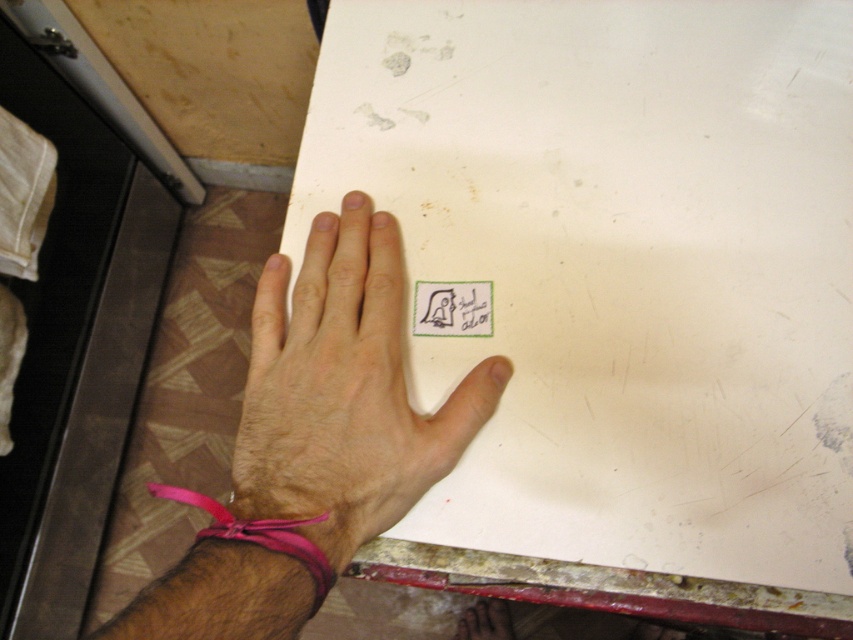
Question: Which of the following is the farthest from the observer?

Choices:
 (A) (236, 433)
 (B) (508, 625)

Answer: (B)

Question: Is green fabric sticker at center smaller than pink fabric wristband at lower center?

Choices:
 (A) no
 (B) yes

Answer: (B)

Question: Among these points, which one is farthest from the camera?

Choices:
 (A) (494, 605)
 (B) (372, 449)

Answer: (A)

Question: Where is white matte paper at center located in relation to hair-covered skin at center in the image?

Choices:
 (A) below
 (B) above

Answer: (B)

Question: Does white matte paper at center have a lesser width compared to green fabric sticker at center?

Choices:
 (A) yes
 (B) no

Answer: (B)

Question: Considering the real-world distances, which object is farthest from the white matte paper at center?

Choices:
 (A) pink fabric wristband at lower center
 (B) hair-covered skin at center
 (C) green fabric sticker at center

Answer: (A)